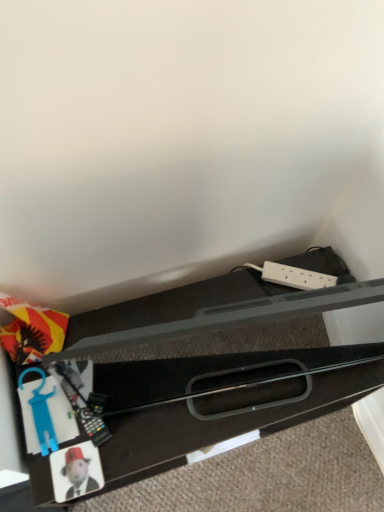
Question: Is blue plastic toy at lower left, which appears as the second toy when ordered from the bottom, in contact with matte plastic coaster at lower left, the 1th toy positioned from the bottom?

Choices:
 (A) yes
 (B) no

Answer: (B)

Question: From a real-world perspective, does blue plastic toy at lower left, marked as the first toy in a top-to-bottom arrangement, sit lower than matte plastic coaster at lower left, the 1th toy positioned from the bottom?

Choices:
 (A) yes
 (B) no

Answer: (B)

Question: Could you tell me if blue plastic toy at lower left, marked as the first toy in a top-to-bottom arrangement, is turned towards matte plastic coaster at lower left, the 1th toy positioned from the bottom?

Choices:
 (A) no
 (B) yes

Answer: (B)

Question: Is blue plastic toy at lower left, which appears as the second toy when ordered from the bottom, far away from matte plastic coaster at lower left, the 1th toy positioned from the bottom?

Choices:
 (A) no
 (B) yes

Answer: (A)

Question: Does blue plastic toy at lower left, which appears as the second toy when ordered from the bottom, appear on the left side of matte plastic coaster at lower left, the 1th toy positioned from the bottom?

Choices:
 (A) yes
 (B) no

Answer: (A)

Question: Considering the relative positions of matte plastic coaster at lower left, the second toy viewed from the top, and blue plastic toy at lower left, which appears as the second toy when ordered from the bottom, in the image provided, is matte plastic coaster at lower left, the second toy viewed from the top, to the left or to the right of blue plastic toy at lower left, which appears as the second toy when ordered from the bottom,?

Choices:
 (A) left
 (B) right

Answer: (B)

Question: Is matte plastic coaster at lower left, the 1th toy positioned from the bottom, wider or thinner than blue plastic toy at lower left, which appears as the second toy when ordered from the bottom?

Choices:
 (A) thin
 (B) wide

Answer: (A)

Question: From the image's perspective, relative to blue plastic toy at lower left, which appears as the second toy when ordered from the bottom, is matte plastic coaster at lower left, the 1th toy positioned from the bottom, above or below?

Choices:
 (A) above
 (B) below

Answer: (B)

Question: Does point (74, 487) appear closer or farther from the camera than point (44, 374)?

Choices:
 (A) closer
 (B) farther

Answer: (A)

Question: Considering the positions of point (170, 366) and point (46, 421), is point (170, 366) closer or farther from the camera than point (46, 421)?

Choices:
 (A) farther
 (B) closer

Answer: (B)

Question: From their relative heights in the image, would you say black plastic drawer at lower left is taller or shorter than blue plastic toy at lower left, marked as the first toy in a top-to-bottom arrangement?

Choices:
 (A) tall
 (B) short

Answer: (A)

Question: Looking at their shapes, would you say black plastic drawer at lower left is wider or thinner than blue plastic toy at lower left, which appears as the second toy when ordered from the bottom?

Choices:
 (A) thin
 (B) wide

Answer: (B)

Question: In the image, is black plastic drawer at lower left positioned in front of or behind blue plastic toy at lower left, marked as the first toy in a top-to-bottom arrangement?

Choices:
 (A) front
 (B) behind

Answer: (A)

Question: From a real-world perspective, is blue plastic toy at lower left, which appears as the second toy when ordered from the bottom, positioned above or below matte plastic coaster at lower left, the second toy viewed from the top?

Choices:
 (A) below
 (B) above

Answer: (B)

Question: Do you think blue plastic toy at lower left, marked as the first toy in a top-to-bottom arrangement, is within matte plastic coaster at lower left, the second toy viewed from the top, or outside of it?

Choices:
 (A) outside
 (B) inside

Answer: (A)